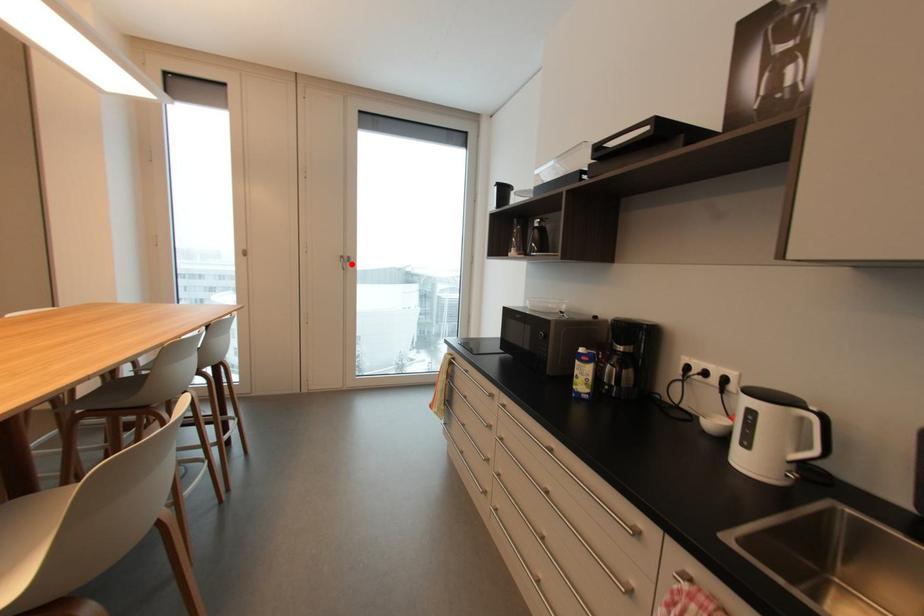
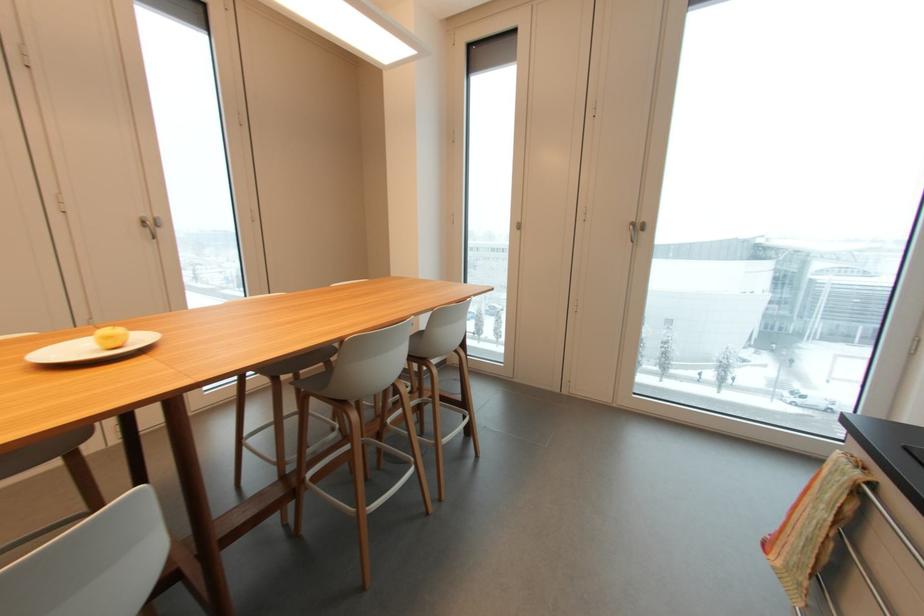
Locate, in the second image, the point that corresponds to the highlighted location in the first image.

(643, 233)